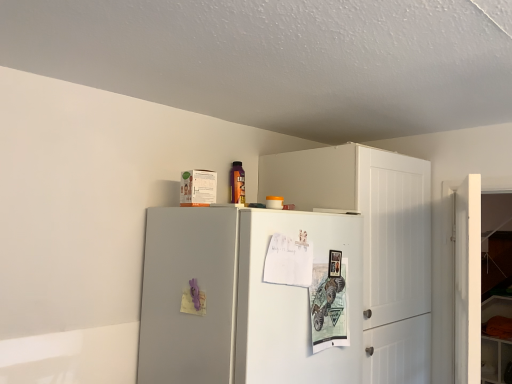
What do you see at coordinates (239, 299) in the screenshot? I see `satin gray refrigerator at upper center` at bounding box center [239, 299].

Measure the distance between point [290,224] and camera.

1.33 meters.

I want to click on white matte cabinet at upper right, so click(374, 242).

This screenshot has width=512, height=384. Find the location of `white matte door at right`. white matte door at right is located at coordinates (x=467, y=281).

At what (x,y) coordinates should I click in order to perform the action: click on satin gray refrigerator at upper center. Please return your answer as a coordinate pair (x, y). Looking at the image, I should click on (239, 299).

Considering the sizes of objects white matte cabinet at upper right and white matte door at right in the image provided, who is shorter, white matte cabinet at upper right or white matte door at right?

white matte door at right is shorter.

What's the angular difference between white matte cabinet at upper right and white matte door at right's facing directions?

23.8 degrees separate the facing orientations of white matte cabinet at upper right and white matte door at right.

What are the coordinates of `cabinetry below the white matte door at right (from the image's perspective)` in the screenshot? It's located at (374, 242).

Is point (372, 341) positioned after point (465, 260)?

Yes, it is.

Considering the positions of objects white matte door at right and satin gray refrigerator at upper center in the image provided, who is in front, white matte door at right or satin gray refrigerator at upper center?

satin gray refrigerator at upper center is more forward.

Are white matte door at right and satin gray refrigerator at upper center located far from each other?

white matte door at right is near satin gray refrigerator at upper center, not far away.

Between white matte door at right and satin gray refrigerator at upper center, which one has smaller size?

white matte door at right is smaller.

Measure the distance between white matte door at right and satin gray refrigerator at upper center.

They are 26.12 inches apart.

Image resolution: width=512 pixels, height=384 pixels. Identify the location of refrigerator on the left of white matte door at right. (239, 299).

Would you say satin gray refrigerator at upper center is outside white matte door at right?

Absolutely, satin gray refrigerator at upper center is external to white matte door at right.

In the scene shown: Which object is closer to the camera, satin gray refrigerator at upper center or white matte door at right?

Positioned in front is satin gray refrigerator at upper center.

From a real-world perspective, which object rests below the other?

satin gray refrigerator at upper center, from a real-world perspective.

The height and width of the screenshot is (384, 512). Identify the location of cabinetry behind the satin gray refrigerator at upper center. (374, 242).

Is satin gray refrigerator at upper center shorter than white matte cabinet at upper right?

Correct, satin gray refrigerator at upper center is not as tall as white matte cabinet at upper right.

In the scene shown: From the image's perspective, which one is positioned higher, satin gray refrigerator at upper center or white matte cabinet at upper right?

white matte cabinet at upper right, from the image's perspective.

Is white matte door at right aimed at white matte cabinet at upper right?

No, white matte door at right is not aimed at white matte cabinet at upper right.

Looking at this image, is white matte door at right far away from white matte cabinet at upper right?

That's not correct — white matte door at right is a little close to white matte cabinet at upper right.

Which point is more distant from viewer, (455, 331) or (380, 214)?

The point (455, 331) is behind.

Considering the sizes of white matte door at right and white matte cabinet at upper right in the image, is white matte door at right wider or thinner than white matte cabinet at upper right?

Clearly, white matte door at right has less width compared to white matte cabinet at upper right.

Is white matte cabinet at upper right wider than satin gray refrigerator at upper center?

No.

Would you say white matte cabinet at upper right is outside satin gray refrigerator at upper center?

That's correct, white matte cabinet at upper right is outside of satin gray refrigerator at upper center.

Is white matte cabinet at upper right facing towards satin gray refrigerator at upper center?

No.

Considering the points (366, 212) and (226, 334), which point is in front, point (366, 212) or point (226, 334)?

The point (226, 334) is more forward.

Find the location of a particular element. The height and width of the screenshot is (384, 512). cabinetry behind the white matte door at right is located at coordinates click(x=374, y=242).

The width and height of the screenshot is (512, 384). Find the location of `door above the satin gray refrigerator at upper center (from the image's perspective)`. door above the satin gray refrigerator at upper center (from the image's perspective) is located at coordinates (467, 281).

When comparing their distances from satin gray refrigerator at upper center, does white matte door at right or white matte cabinet at upper right seem further?

white matte door at right is positioned further to the anchor satin gray refrigerator at upper center.

Based on their spatial positions, is satin gray refrigerator at upper center or white matte door at right closer to white matte cabinet at upper right?

white matte door at right is positioned closer to the anchor white matte cabinet at upper right.

When comparing their distances from satin gray refrigerator at upper center, does white matte cabinet at upper right or white matte door at right seem further?

white matte door at right is positioned further to the anchor satin gray refrigerator at upper center.

From the image, which object appears to be farther from white matte door at right, white matte cabinet at upper right or satin gray refrigerator at upper center?

Among the two, satin gray refrigerator at upper center is located further to white matte door at right.

Looking at the image, which one is located closer to white matte door at right, satin gray refrigerator at upper center or white matte cabinet at upper right?

white matte cabinet at upper right is positioned closer to the anchor white matte door at right.

Estimate the real-world distances between objects in this image. Which object is further from white matte cabinet at upper right, white matte door at right or satin gray refrigerator at upper center?

satin gray refrigerator at upper center lies further to white matte cabinet at upper right than the other object.

The height and width of the screenshot is (384, 512). Identify the location of cabinetry between satin gray refrigerator at upper center and white matte door at right in the horizontal direction. (374, 242).